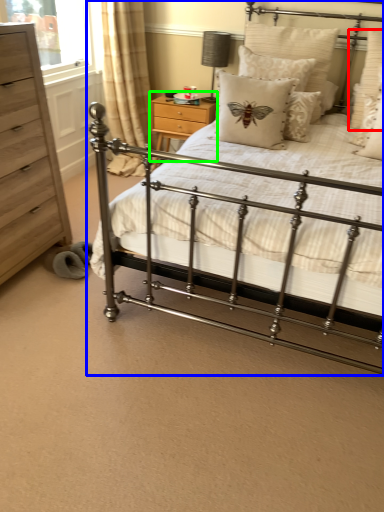
Question: Estimate the real-world distances between objects in this image. Which object is closer to pillow (highlighted by a red box), bed (highlighted by a blue box) or nightstand (highlighted by a green box)?

Choices:
 (A) bed
 (B) nightstand

Answer: (A)